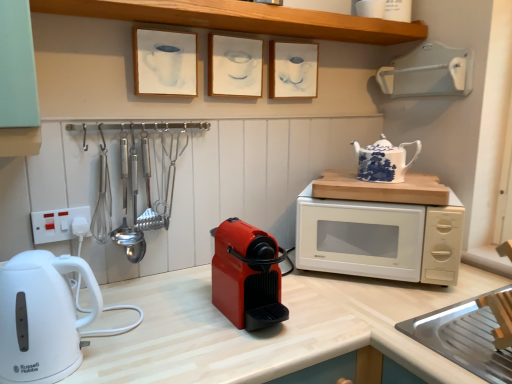
Question: Is wooden at upper center inside the boundaries of white paper picture frame at upper center, which is counted as the third picture frame, starting from the right, or outside?

Choices:
 (A) outside
 (B) inside

Answer: (A)

Question: Is point (185, 6) closer or farther from the camera than point (153, 72)?

Choices:
 (A) farther
 (B) closer

Answer: (B)

Question: Considering the real-world distances, which object is farthest from the matte white picture frame at center, the second picture frame viewed from the left?

Choices:
 (A) white glossy electric kettle at left, which ranks as the second home appliance in right-to-left order
 (B) white paper picture frame at upper center, marked as the 1th picture frame in a left-to-right arrangement
 (C) blue and white porcelain teapot at upper right
 (D) matte white picture frame at upper center, the third picture frame positioned from the left
 (E) white matte microwave at right

Answer: (A)

Question: Estimate the real-world distances between objects in this image. Which object is closer to the wooden at upper center?

Choices:
 (A) matte white picture frame at center, positioned as the 2th picture frame in right-to-left order
 (B) white paper picture frame at upper center, marked as the 1th picture frame in a left-to-right arrangement
 (C) matte plastic coffee machine at center, the 2th home appliance when ordered from left to right
 (D) white matte microwave at right
 (E) matte white picture frame at upper center, arranged as the first picture frame when viewed from the right

Answer: (A)